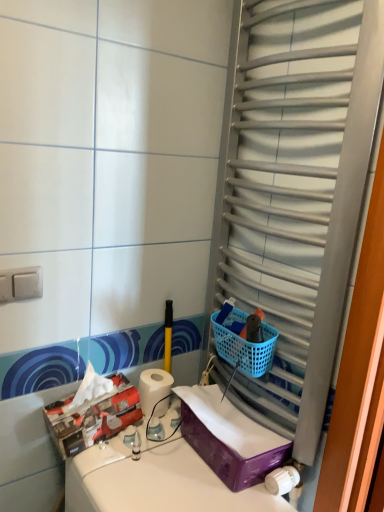
Describe the element at coordinates (93, 417) in the screenshot. I see `matte cardboard tissue box at lower left, which ranks as the second storage box in right-to-left order` at that location.

What is the approximate width of matte cardboard tissue box at lower left, which ranks as the second storage box in right-to-left order?

matte cardboard tissue box at lower left, which ranks as the second storage box in right-to-left order, is 6.41 inches wide.

Image resolution: width=384 pixels, height=512 pixels. What do you see at coordinates (155, 480) in the screenshot?
I see `purple plastic container at lower right` at bounding box center [155, 480].

What do you see at coordinates (244, 345) in the screenshot?
I see `blue plastic basket at right` at bounding box center [244, 345].

What do you see at coordinates (153, 388) in the screenshot?
I see `white matte toilet paper at center` at bounding box center [153, 388].

Where is `metallic silver towel rack at right`? The width and height of the screenshot is (384, 512). metallic silver towel rack at right is located at coordinates (296, 190).

Is white plastic switch at upper left aimed at metallic silver towel rack at right?

No, white plastic switch at upper left is not oriented towards metallic silver towel rack at right.

Is white plastic switch at upper left surrounding metallic silver towel rack at right?

No.

Is the position of white plastic switch at upper left less distant than that of metallic silver towel rack at right?

That is False.

How different are the orientations of white plastic switch at upper left and metallic silver towel rack at right in degrees?

90.6 degrees separate the facing orientations of white plastic switch at upper left and metallic silver towel rack at right.

Which point is more distant from viewer, (75,507) or (132,422)?

The point (132,422) is farther from the camera.

Where is `counter top below the matte cardboard tissue box at lower left, which ranks as the second storage box in right-to-left order (from a real-world perspective)`? The height and width of the screenshot is (512, 384). counter top below the matte cardboard tissue box at lower left, which ranks as the second storage box in right-to-left order (from a real-world perspective) is located at coordinates (155, 480).

Does purple plastic container at lower right have a lesser height compared to matte cardboard tissue box at lower left, which ranks as the second storage box in right-to-left order?

No, purple plastic container at lower right is not shorter than matte cardboard tissue box at lower left, which ranks as the second storage box in right-to-left order.

Which object is closer to the camera, purple plastic container at lower right or matte cardboard tissue box at lower left, positioned as the 1th storage box in left-to-right order?

purple plastic container at lower right is more forward.

Is blue plastic basket at right to the left or to the right of metallic silver towel rack at right in the image?

From the image, it's evident that blue plastic basket at right is to the left of metallic silver towel rack at right.

Is blue plastic basket at right facing towards metallic silver towel rack at right?

Yes, blue plastic basket at right is oriented towards metallic silver towel rack at right.

From a real-world perspective, between blue plastic basket at right and metallic silver towel rack at right, who is vertically lower?

In real-world perspective, blue plastic basket at right is lower.

From the image's perspective, relative to metallic silver towel rack at right, is blue plastic basket at right above or below?

From the image's perspective, blue plastic basket at right appears below metallic silver towel rack at right.

Does purple plastic container at lower right lie behind white matte toilet paper at center?

No, the depth of purple plastic container at lower right is less than that of white matte toilet paper at center.

There is a purple plastic container at lower right. Identify the location of toilet paper above it (from a real-world perspective). This screenshot has height=512, width=384. (153, 388).

From a real-world perspective, who is located lower, purple plastic container at lower right or white matte toilet paper at center?

purple plastic container at lower right, from a real-world perspective.

At what (x,y) coordinates should I click in order to perform the action: click on storage box on the right of the matte cardboard tissue box at lower left, which ranks as the second storage box in right-to-left order. Please return your answer as a coordinate pair (x, y). Looking at the image, I should click on (229, 438).

Would you say purple plastic storage box at lower right, placed as the second storage box when sorted from left to right, is to the left or to the right of matte cardboard tissue box at lower left, positioned as the 1th storage box in left-to-right order, in the picture?

purple plastic storage box at lower right, placed as the second storage box when sorted from left to right, is positioned on matte cardboard tissue box at lower left, positioned as the 1th storage box in left-to-right order,'s right side.

From the image's perspective, between purple plastic storage box at lower right, placed as the second storage box when sorted from left to right, and matte cardboard tissue box at lower left, which ranks as the second storage box in right-to-left order, who is located below?

purple plastic storage box at lower right, placed as the second storage box when sorted from left to right, from the image's perspective.

Is metallic silver towel rack at right inside or outside of white plastic switch at upper left?

metallic silver towel rack at right is spatially situated outside white plastic switch at upper left.

What's the angular difference between metallic silver towel rack at right and white plastic switch at upper left's facing directions?

90.6 degrees separate the facing orientations of metallic silver towel rack at right and white plastic switch at upper left.

Can you confirm if metallic silver towel rack at right is positioned to the left of white plastic switch at upper left?

No.

Between metallic silver towel rack at right and white plastic switch at upper left, which one has larger width?

metallic silver towel rack at right is wider.

Based on the photo, in terms of width, does matte cardboard tissue box at lower left, which ranks as the second storage box in right-to-left order, look wider or thinner when compared to blue plastic basket at right?

matte cardboard tissue box at lower left, which ranks as the second storage box in right-to-left order, is wider than blue plastic basket at right.

How different are the orientations of matte cardboard tissue box at lower left, positioned as the 1th storage box in left-to-right order, and blue plastic basket at right in degrees?

The angle between the facing direction of matte cardboard tissue box at lower left, positioned as the 1th storage box in left-to-right order, and the facing direction of blue plastic basket at right is 90.5 degrees.

Identify the location of basket above the matte cardboard tissue box at lower left, positioned as the 1th storage box in left-to-right order (from a real-world perspective). tap(244, 345).

The width and height of the screenshot is (384, 512). Find the location of `electric outlet behind the metallic silver towel rack at right`. electric outlet behind the metallic silver towel rack at right is located at coordinates (21, 284).

From the image's perspective, count 2nd storage boxs upward from the purple plastic container at lower right and point to it. Please provide its 2D coordinates.

[(93, 417)]

From the image, which object appears to be nearer to purple plastic storage box at lower right, placed as the second storage box when sorted from left to right, metallic silver towel rack at right or white matte toilet paper at center?

white matte toilet paper at center lies closer to purple plastic storage box at lower right, placed as the second storage box when sorted from left to right, than the other object.

When comparing their distances from blue plastic basket at right, does white matte toilet paper at center or purple plastic storage box at lower right, arranged as the first storage box when viewed from the right, seem further?

white matte toilet paper at center.

From the image, which object appears to be farther from blue plastic basket at right, metallic silver towel rack at right or purple plastic storage box at lower right, arranged as the first storage box when viewed from the right?

The object further to blue plastic basket at right is metallic silver towel rack at right.

Based on their spatial positions, is white plastic switch at upper left or white matte toilet paper at center closer to metallic silver towel rack at right?

white matte toilet paper at center is closer to metallic silver towel rack at right.

From the picture: Based on their spatial positions, is purple plastic storage box at lower right, placed as the second storage box when sorted from left to right, or blue plastic basket at right closer to metallic silver towel rack at right?

blue plastic basket at right lies closer to metallic silver towel rack at right than the other object.

Estimate the real-world distances between objects in this image. Which object is further from purple plastic container at lower right, blue plastic basket at right or metallic silver towel rack at right?

Based on the image, metallic silver towel rack at right appears to be further to purple plastic container at lower right.

Looking at this image, when comparing their distances from matte cardboard tissue box at lower left, positioned as the 1th storage box in left-to-right order, does metallic silver towel rack at right or white matte toilet paper at center seem closer?

The object closer to matte cardboard tissue box at lower left, positioned as the 1th storage box in left-to-right order, is white matte toilet paper at center.

When comparing their distances from matte cardboard tissue box at lower left, which ranks as the second storage box in right-to-left order, does metallic silver towel rack at right or blue plastic basket at right seem closer?

Among the two, blue plastic basket at right is located nearer to matte cardboard tissue box at lower left, which ranks as the second storage box in right-to-left order.

Locate an element on the screen. The image size is (384, 512). toilet paper located between white plastic switch at upper left and purple plastic storage box at lower right, arranged as the first storage box when viewed from the right, in the left-right direction is located at coordinates (153, 388).

What are the coordinates of `basket between metallic silver towel rack at right and purple plastic storage box at lower right, placed as the second storage box when sorted from left to right, vertically` in the screenshot? It's located at (244, 345).

Where is `basket between metallic silver towel rack at right and purple plastic container at lower right in the up-down direction`? basket between metallic silver towel rack at right and purple plastic container at lower right in the up-down direction is located at coordinates (244, 345).

Identify the location of toilet paper between white plastic switch at upper left and blue plastic basket at right in the horizontal direction. Image resolution: width=384 pixels, height=512 pixels. (153, 388).